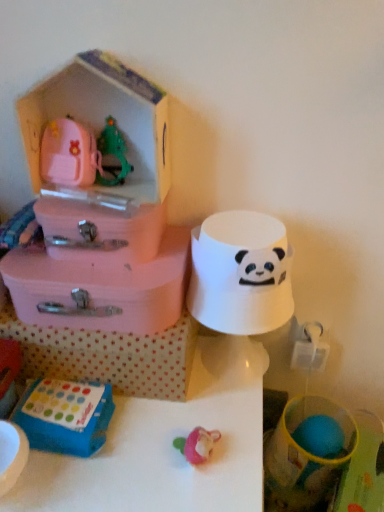
Identify the location of vacant space underneath white felt hat at right, marked as the first toy in a right-to-left arrangement (from a real-world perspective). This screenshot has height=512, width=384. (233, 364).